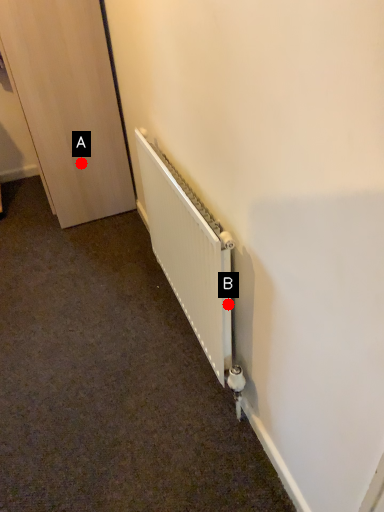
Question: Two points are circled on the image, labeled by A and B beside each circle. Among these points, which one is farthest from the camera?

Choices:
 (A) A is further
 (B) B is further

Answer: (A)